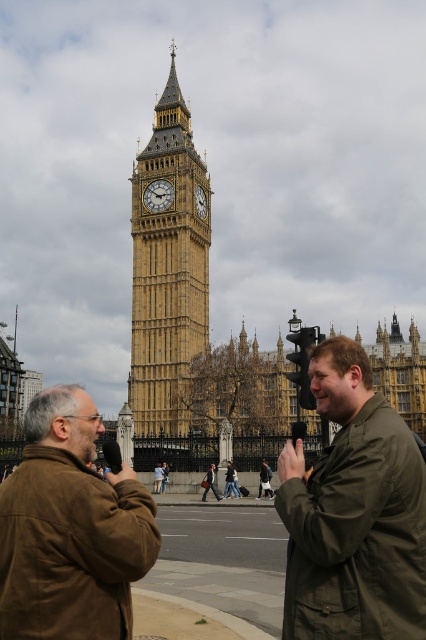
Who is taller, olive-green jacket at center-right or golden stone clock tower at center?

Standing taller between the two is golden stone clock tower at center.

Who is lower down, olive-green jacket at center-right or golden stone clock tower at center?

Positioned lower is olive-green jacket at center-right.

Describe the element at coordinates (354, 513) in the screenshot. I see `olive-green jacket at center-right` at that location.

This screenshot has height=640, width=426. Find the location of `olive-green jacket at center-right`. olive-green jacket at center-right is located at coordinates (354, 513).

Does point (58, 547) lie in front of point (161, 209)?

Yes, point (58, 547) is closer to viewer.

Is brown leather jacket at lower left behind gold textured clock tower at center?

That is False.

The height and width of the screenshot is (640, 426). Describe the element at coordinates (71, 529) in the screenshot. I see `brown leather jacket at lower left` at that location.

At what (x,y) coordinates should I click in order to perform the action: click on brown leather jacket at lower left. Please return your answer as a coordinate pair (x, y). This screenshot has width=426, height=640. Looking at the image, I should click on (71, 529).

Does gold textured clock tower at center have a greater width compared to gold/yellow stone clock tower at center?

Yes.

Is gold textured clock tower at center positioned at the back of gold/yellow stone clock tower at center?

That is False.

Is point (149, 202) closer to viewer compared to point (204, 216)?

Yes.

Identify the location of gold textured clock tower at center. This screenshot has height=640, width=426. (158, 195).